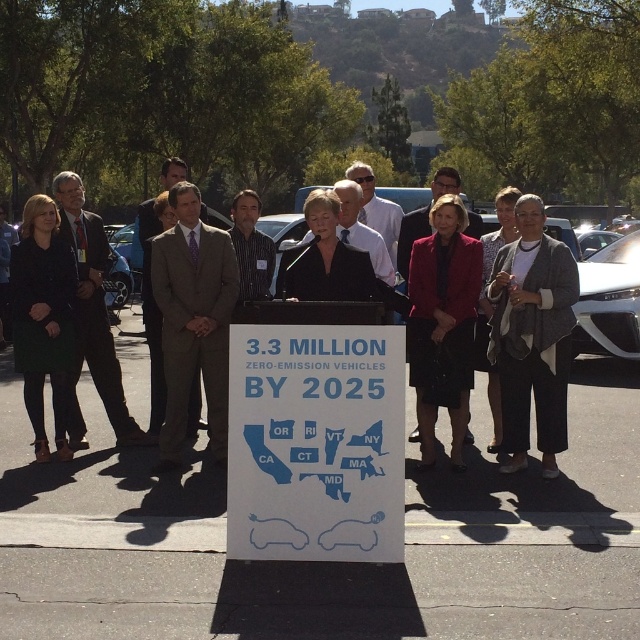
From the picture: Which of these two, brown wool suit at center or matte black suit at center, stands shorter?

Standing shorter between the two is brown wool suit at center.

I want to click on brown wool suit at center, so click(193, 321).

Does point (193, 205) lie behind point (401, 276)?

No, (193, 205) is in front of (401, 276).

Image resolution: width=640 pixels, height=640 pixels. In order to click on brown wool suit at center in this screenshot , I will do `click(193, 321)`.

The image size is (640, 640). Describe the element at coordinates (316, 442) in the screenshot. I see `blue paper sign at center` at that location.

Is blue paper sign at center bigger than striped shirt at center?

No, blue paper sign at center is not bigger than striped shirt at center.

Where is `blue paper sign at center`? The width and height of the screenshot is (640, 640). blue paper sign at center is located at coordinates (316, 442).

Does gray woolen sweater at center appear on the left side of matte black coat at left?

Incorrect, gray woolen sweater at center is not on the left side of matte black coat at left.

Between point (545, 381) and point (35, 256), which one is positioned in front?

Point (545, 381)

Locate an element on the screen. This screenshot has width=640, height=640. gray woolen sweater at center is located at coordinates (532, 337).